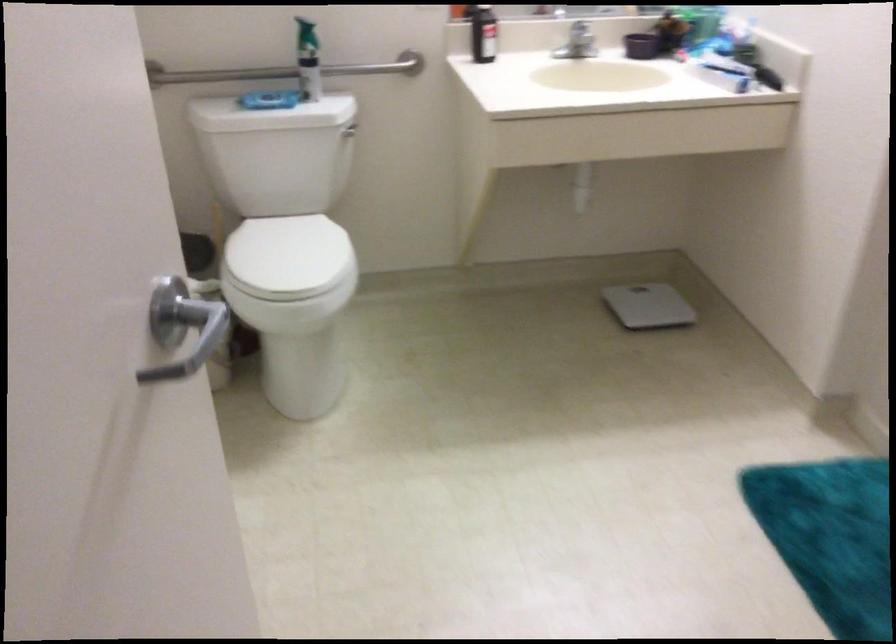
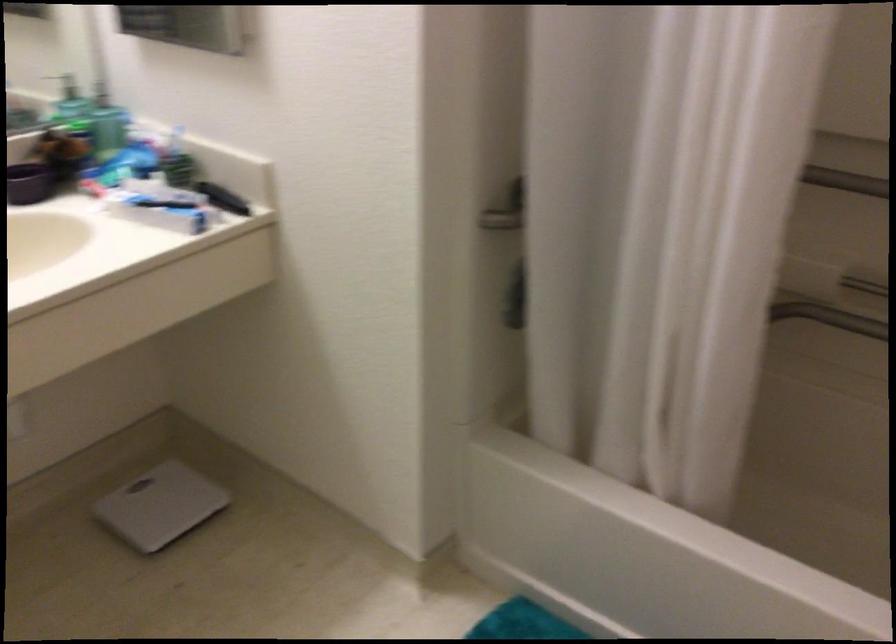
Question: The first image is from the beginning of the video and the second image is from the end. How did the camera likely rotate when shooting the video?

Choices:
 (A) Left
 (B) Right
 (C) Up
 (D) Down

Answer: (B)